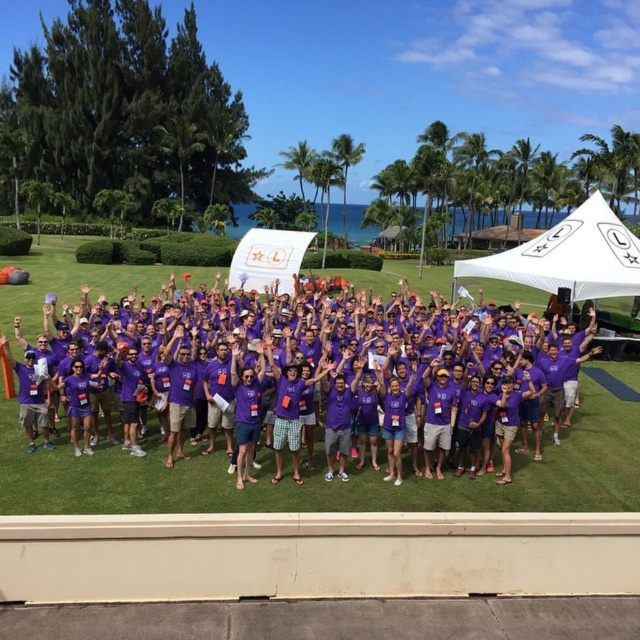
You are a photographer at the event and want to capture a photo of the purple cotton shirt at center and the white fabric canopy at center. Which object should you focus on first to ensure both are in focus?

The photographer should focus on the purple cotton shirt at center first because it is closer to the viewer than the white fabric canopy at center, so by focusing on the closer object, the canopy will be within the depth of field.

You are a photographer at this event and want to capture a photo that includes both the purple cotton shirt at center and the white fabric canopy at center. From the perspective of the photographer standing behind the group, which object should you position on the left side of the frame to ensure both are included?

The purple cotton shirt at center should be positioned on the left side of the frame because it is already on the left side of the white fabric canopy at center, so placing it there will include both in the photo.

You are a photographer at the event and want to capture a photo of the purple cotton shirt at center without the white fabric canopy at center appearing in the background. Is this possible?

The purple cotton shirt at center is below the white fabric canopy at center, so it is possible to capture a photo of the purple cotton shirt at center without the white fabric canopy at center in the background by adjusting the camera angle to exclude the canopy.